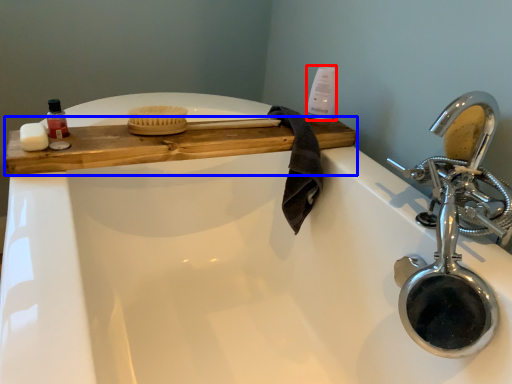
Question: Which object appears closest to the camera in this image, cleaning product (highlighted by a red box) or counter (highlighted by a blue box)?

Choices:
 (A) cleaning product
 (B) counter

Answer: (B)